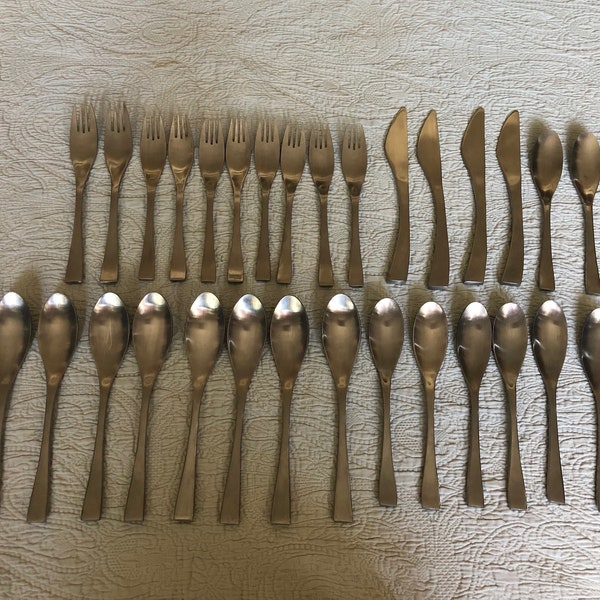
The width and height of the screenshot is (600, 600). I want to click on fork, so click(84, 160), click(118, 166), click(153, 157), click(177, 166), click(210, 161), click(233, 164), click(257, 165), click(294, 163), click(323, 167), click(354, 163).